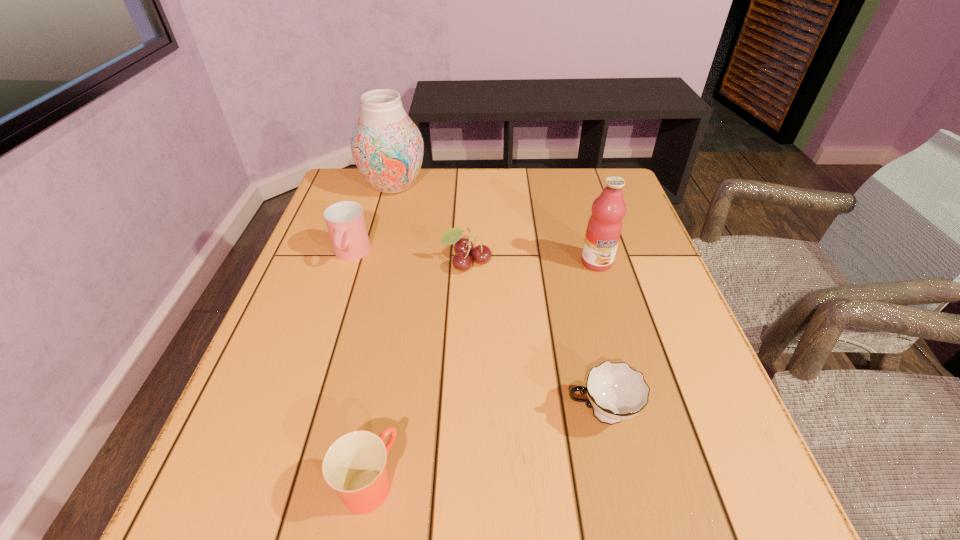
Where is `cup at the left edge`? cup at the left edge is located at coordinates (345, 221).

The width and height of the screenshot is (960, 540). Find the location of `fruit juice present at the right edge`. fruit juice present at the right edge is located at coordinates (604, 228).

Find the location of a particular element. The width and height of the screenshot is (960, 540). cup that is at the right edge is located at coordinates pos(615,391).

Image resolution: width=960 pixels, height=540 pixels. What are the coordinates of `object present at the far left corner` in the screenshot? It's located at (387, 147).

Identify the location of vacant space at the far edge of the desktop. The height and width of the screenshot is (540, 960). (433, 179).

I want to click on vacant space at the left edge, so click(214, 457).

Find the location of a particular element. The image size is (960, 540). free space at the right edge is located at coordinates (660, 281).

Find the location of a particular element. The height and width of the screenshot is (540, 960). free space at the far left corner of the desktop is located at coordinates (359, 184).

Identify the location of free spot at the near right corner of the desktop. Image resolution: width=960 pixels, height=540 pixels. (752, 531).

Image resolution: width=960 pixels, height=540 pixels. I want to click on free space between the second tallest object and the fourth object from left to right, so click(532, 262).